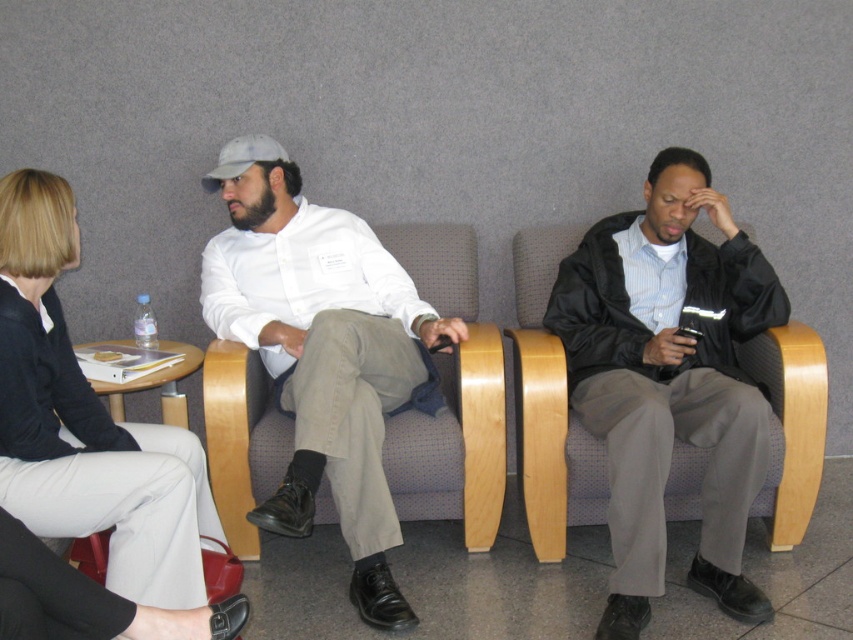
You are standing in the waiting area and see two points marked on the floor. The first point is at coordinates point (x=399, y=378) and the second point is at point (x=154, y=529). If you want to walk from the first point to the second point, which direction should you move relative to the second point?

You should move towards the direction opposite of the second point, as point (x=399, y=378) is behind point (x=154, y=529).

You are a tailor measuring jackets and shirts for alterations. You have a customer who wants to know if their black matte jacket at center will fit over their matte white shirt at center. Based on the image, can you determine if the jacket is wide enough?

The black matte jacket at center is narrower than the matte white shirt at center, so it may not fit comfortably over the shirt. The customer should consider alterations or a larger jacket.